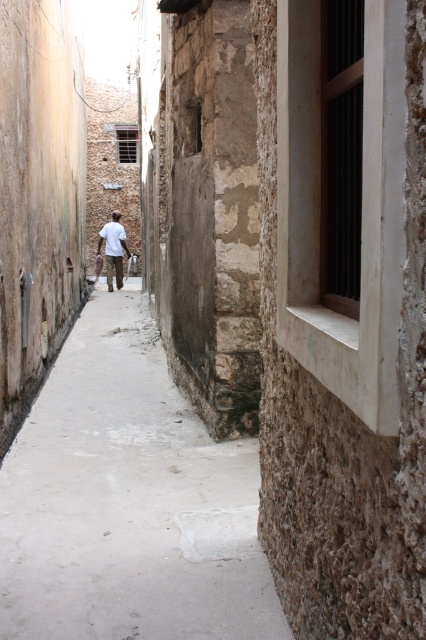
Question: Which object is closer to the camera taking this photo?

Choices:
 (A) smooth concrete pavement at center
 (B) white matte shirt at center

Answer: (A)

Question: Can you confirm if smooth concrete pavement at center is thinner than white matte shirt at center?

Choices:
 (A) yes
 (B) no

Answer: (A)

Question: Among these objects, which one is farthest from the camera?

Choices:
 (A) white matte shirt at center
 (B) smooth concrete pavement at center

Answer: (A)

Question: In this image, where is smooth concrete pavement at center located relative to white matte shirt at center?

Choices:
 (A) right
 (B) left

Answer: (A)

Question: Does smooth concrete pavement at center appear on the right side of white matte shirt at center?

Choices:
 (A) yes
 (B) no

Answer: (A)